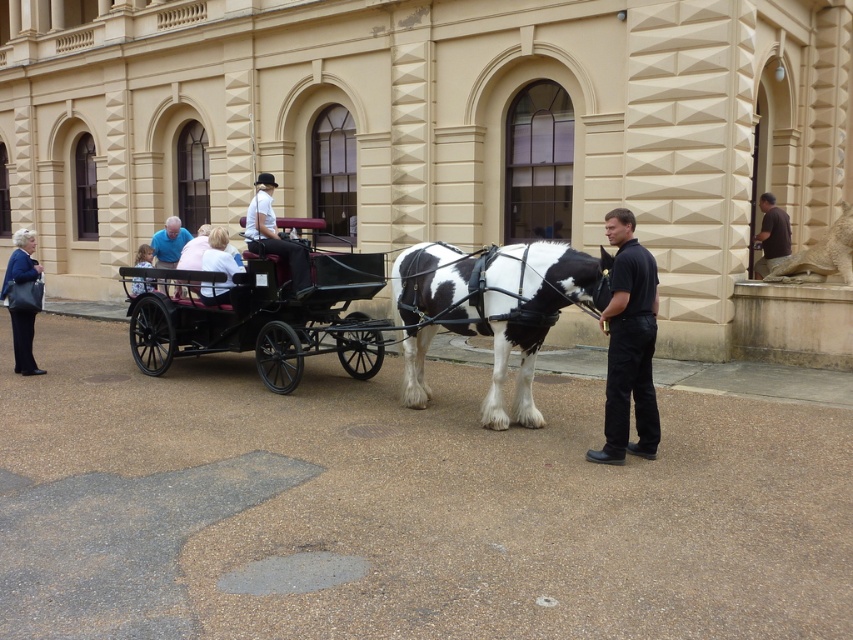
You are standing at the entrance of the beige building and want to take a photo of the black smooth shirt at center. Where should you position yourself to capture it in the frame?

The black smooth shirt at center is located at point 0.539 on the x axis and 0.737 on the y axis, so you should position yourself in the center of the scene slightly towards the lower half to capture it in the frame.

In the scene shown: You are standing in front of the beige building and want to take a photo of the horse drawn carriage. The camera you are using has a zoom lens that can focus on objects up to 5 meters away. The distance from your position to point (267, 177) is 4 meters and to point (219, 292) is 6 meters. Will both points be in focus?

Point (267, 177) is within the 5 meter range and will be in focus, but point (219, 292) is 6 meters away which exceeds the camera limit, so it will be out of focus.